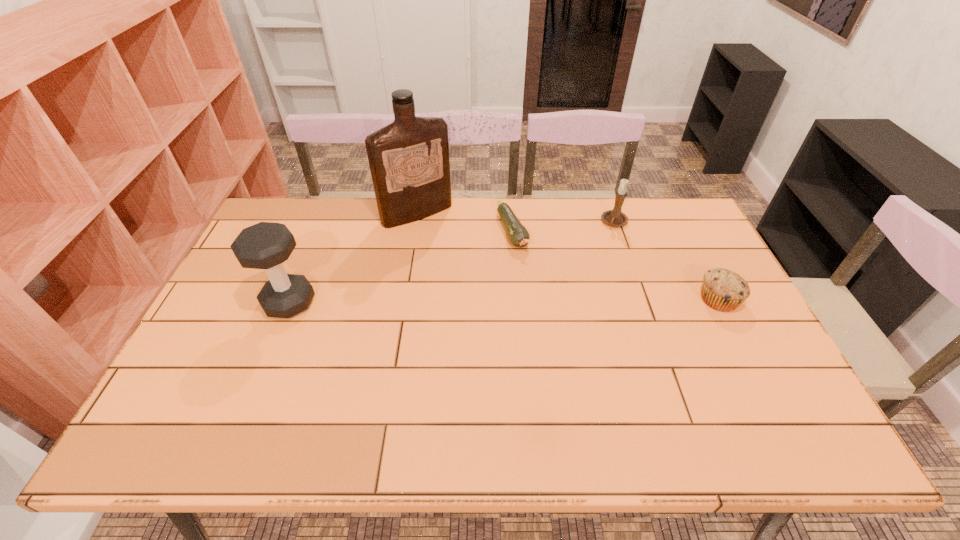
Find the location of a particular element. The width and height of the screenshot is (960, 540). vacant space on the desktop that is between the leftmost object and the second shortest object and is positioned on the label side of the liquor is located at coordinates (488, 301).

Locate an element on the screen. vacant space on the desktop that is between the dumbbell and the rightmost object and is positioned at the blossom end of the third object from right to left is located at coordinates (543, 301).

Where is `vacant spot on the desktop that is between the leftmost object and the muffin and is positioned on the side of the second object from right to left with the handle`? vacant spot on the desktop that is between the leftmost object and the muffin and is positioned on the side of the second object from right to left with the handle is located at coordinates (560, 301).